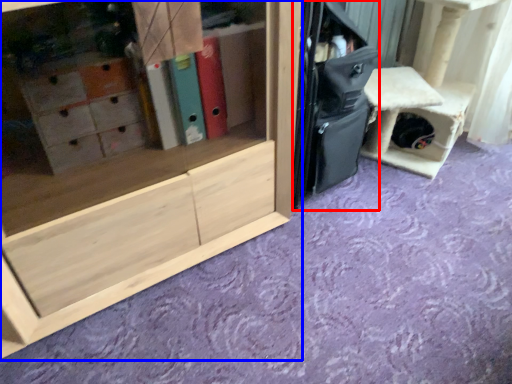
Question: Which object appears farthest to the camera in this image, luggage (highlighted by a red box) or cabinetry (highlighted by a blue box)?

Choices:
 (A) luggage
 (B) cabinetry

Answer: (A)